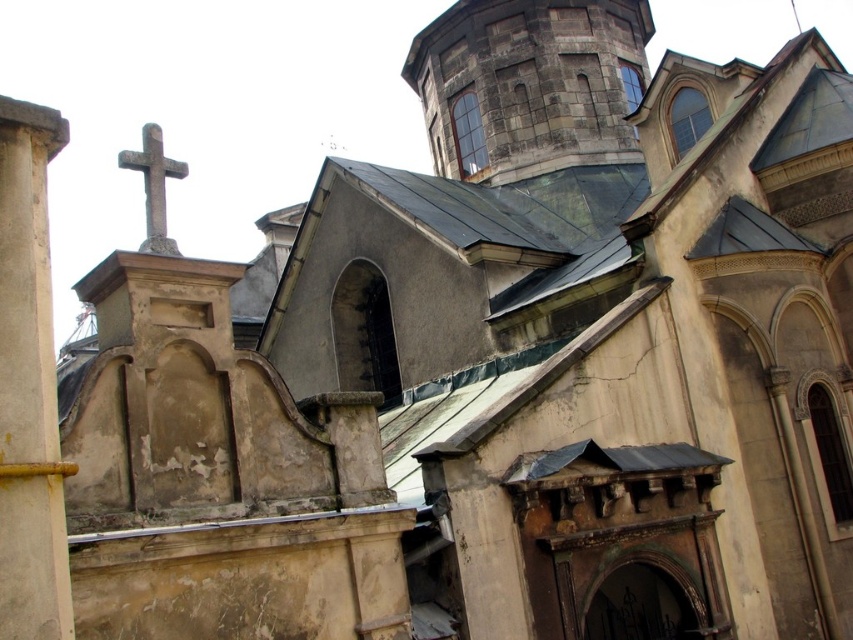
You are an architect analyzing the dimensions of the historic building. Based on the image, which object has a larger size between the yellow painted concrete column at left and the smooth stone cross at upper left?

The smooth stone cross at upper left is larger than the yellow painted concrete column at left.

You are standing at the entrance of the historic building and notice a yellow painted concrete column at left. Can you confirm if this column is located at the coordinates point [28,387]?

The yellow painted concrete column at left is represented by point [28,387].